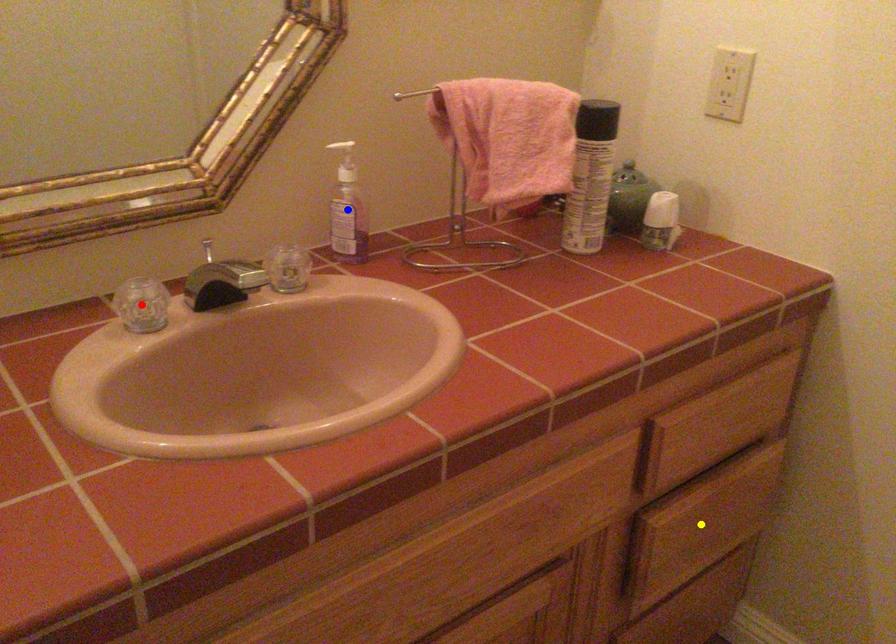
Order these from nearest to farthest:
- red point
- blue point
- yellow point

red point < blue point < yellow point